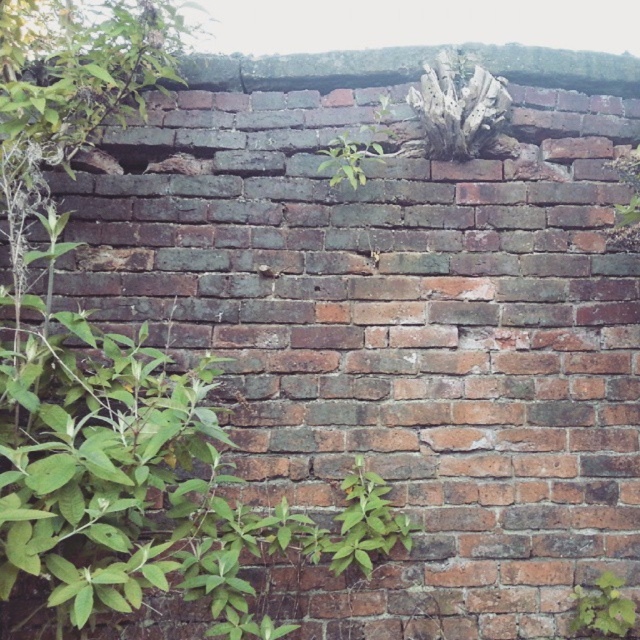
Who is lower down, green leafy plant at lower right or green leafy plant at center?

Positioned lower is green leafy plant at lower right.

In the scene shown: Does green leafy plant at lower right have a larger size compared to green leafy plant at center?

No.

Does point (602, 600) lie behind point (364, 180)?

No, it is in front of (364, 180).

Locate an element on the screen. green leafy plant at lower right is located at coordinates (602, 609).